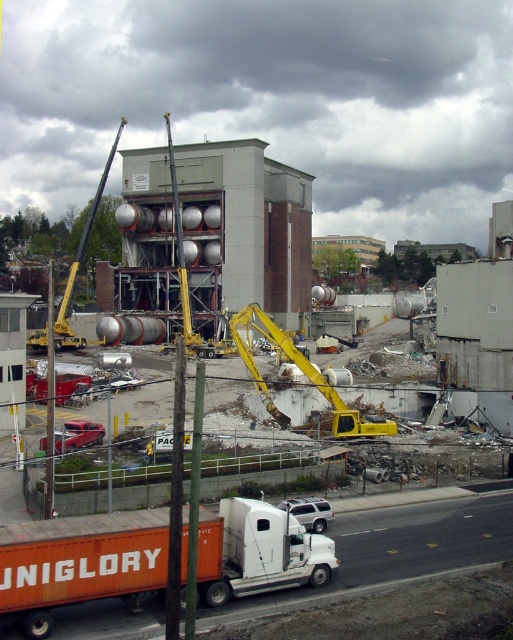
This screenshot has width=513, height=640. I want to click on orange matte trailer truck at lower left, so coord(80,563).

Is orange matte trailer truck at lower left shorter than yellow metallic excavator at center?

Yes, orange matte trailer truck at lower left is shorter than yellow metallic excavator at center.

Between point (209, 518) and point (269, 404), which one is positioned in front?

Point (209, 518) is more forward.

I want to click on orange matte trailer truck at lower left, so click(80, 563).